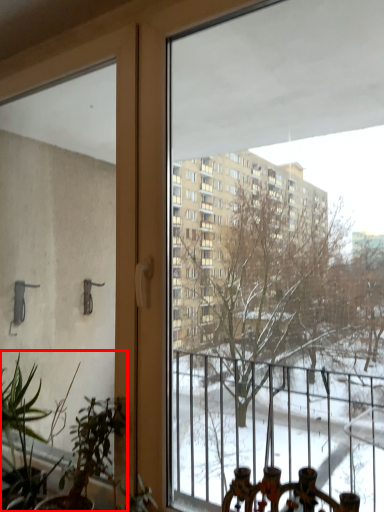
Question: In this image, where is houseplant (annotated by the red box) located relative to plant?

Choices:
 (A) left
 (B) right

Answer: (B)